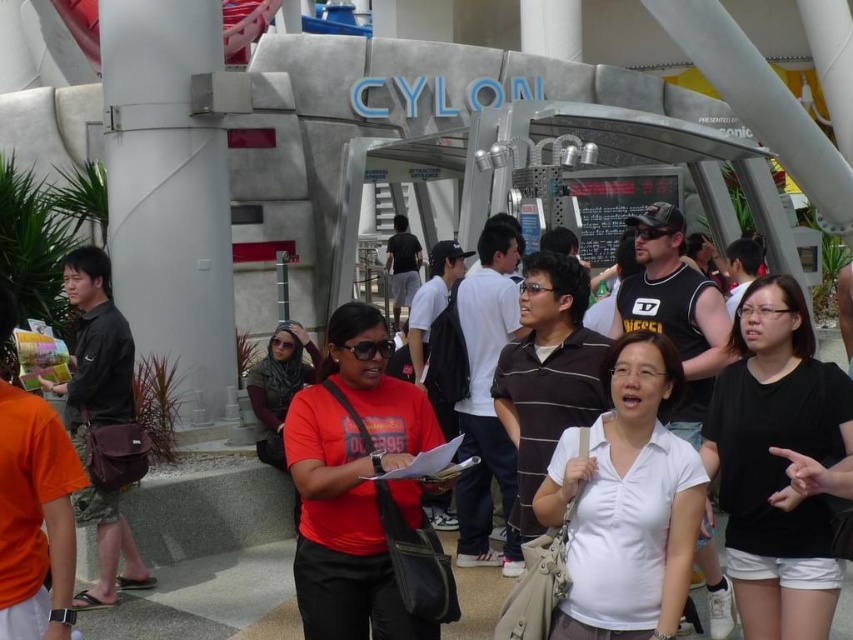
Question: Can you confirm if white matte pillar at left is smaller than matte black bag at left?

Choices:
 (A) no
 (B) yes

Answer: (A)

Question: Does white matte pillar at left have a smaller size compared to black cotton shirt at center?

Choices:
 (A) yes
 (B) no

Answer: (A)

Question: Which of the following is the closest to the observer?

Choices:
 (A) white matte pillar at left
 (B) brown striped polo shirt at center

Answer: (B)

Question: Which point appears closest to the camera in this image?

Choices:
 (A) (782, 371)
 (B) (7, 305)

Answer: (B)

Question: Which object is closer to the camera taking this photo?

Choices:
 (A) matte black shirt at left
 (B) brown striped polo shirt at center
 (C) matte black bag at left
 (D) black cotton shirt at center

Answer: (A)

Question: Does white matte shirt at center appear under brown striped polo shirt at center?

Choices:
 (A) no
 (B) yes

Answer: (B)